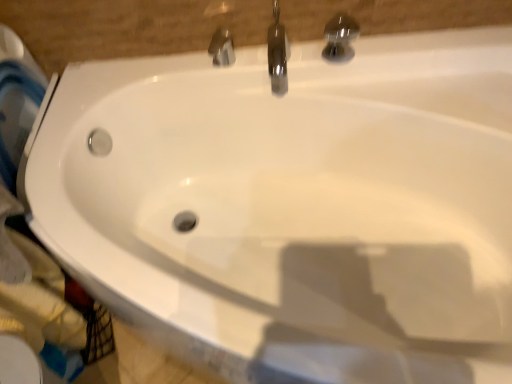
Question: Considering the relative sizes of polished chrome faucet at upper center, which ranks as the first tap in left-to-right order, and polished chrome faucet at upper center, which is counted as the second tap, starting from the left, in the image provided, is polished chrome faucet at upper center, which ranks as the first tap in left-to-right order, thinner than polished chrome faucet at upper center, which is counted as the second tap, starting from the left,?

Choices:
 (A) yes
 (B) no

Answer: (A)

Question: Is polished chrome faucet at upper center, which ranks as the first tap in left-to-right order, to the right of polished chrome faucet at upper center, which is counted as the second tap, starting from the left, from the viewer's perspective?

Choices:
 (A) no
 (B) yes

Answer: (A)

Question: Is polished chrome faucet at upper center, which ranks as the 3th tap in right-to-left order, not close to polished chrome faucet at upper center, which is counted as the second tap, starting from the left?

Choices:
 (A) yes
 (B) no

Answer: (B)

Question: Is polished chrome faucet at upper center, which ranks as the 3th tap in right-to-left order, outside polished chrome faucet at upper center, which is the second tap from right to left?

Choices:
 (A) yes
 (B) no

Answer: (A)

Question: Is the depth of polished chrome faucet at upper center, which ranks as the 3th tap in right-to-left order, less than that of polished chrome faucet at upper center, which is counted as the second tap, starting from the left?

Choices:
 (A) yes
 (B) no

Answer: (B)

Question: Choose the correct answer: Is polished chrome tap at upper center, the first tap positioned from the right, inside polished chrome faucet at upper center, which is counted as the second tap, starting from the left, or outside it?

Choices:
 (A) outside
 (B) inside

Answer: (A)

Question: From a real-world perspective, is polished chrome tap at upper center, the first tap positioned from the right, positioned above or below polished chrome faucet at upper center, which is counted as the second tap, starting from the left?

Choices:
 (A) above
 (B) below

Answer: (A)

Question: In the image, is polished chrome tap at upper center, the third tap when ordered from left to right, on the left side or the right side of polished chrome faucet at upper center, which is the second tap from right to left?

Choices:
 (A) right
 (B) left

Answer: (A)

Question: Looking at the image, does polished chrome tap at upper center, the first tap positioned from the right, seem bigger or smaller compared to polished chrome faucet at upper center, which is counted as the second tap, starting from the left?

Choices:
 (A) small
 (B) big

Answer: (B)

Question: Visually, is polished chrome tap at upper center, the third tap when ordered from left to right, positioned to the left or to the right of polished chrome faucet at upper center, which ranks as the 3th tap in right-to-left order?

Choices:
 (A) right
 (B) left

Answer: (A)

Question: Is polished chrome tap at upper center, the first tap positioned from the right, taller or shorter than polished chrome faucet at upper center, which ranks as the first tap in left-to-right order?

Choices:
 (A) tall
 (B) short

Answer: (A)

Question: Is polished chrome tap at upper center, the third tap when ordered from left to right, spatially inside polished chrome faucet at upper center, which ranks as the 3th tap in right-to-left order, or outside of it?

Choices:
 (A) outside
 (B) inside

Answer: (A)

Question: Does point (332, 26) appear closer or farther from the camera than point (229, 52)?

Choices:
 (A) farther
 (B) closer

Answer: (B)

Question: Is point (284, 61) positioned closer to the camera than point (220, 31)?

Choices:
 (A) closer
 (B) farther

Answer: (A)

Question: Is polished chrome faucet at upper center, which is the second tap from right to left, spatially inside polished chrome faucet at upper center, which ranks as the 3th tap in right-to-left order, or outside of it?

Choices:
 (A) outside
 (B) inside

Answer: (A)